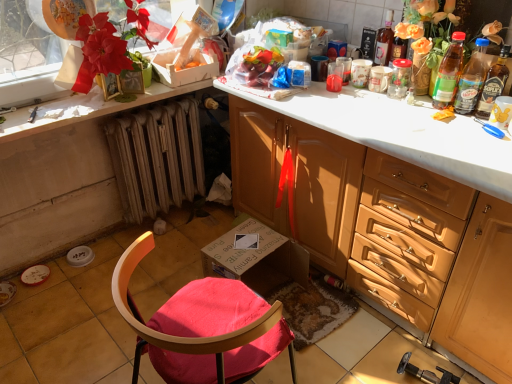
Where is `free space above wooden radiator at lower left (from a real-world perspective)`? free space above wooden radiator at lower left (from a real-world perspective) is located at coordinates (155, 109).